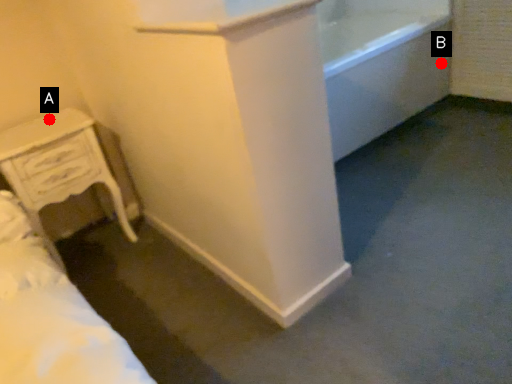
Question: Two points are circled on the image, labeled by A and B beside each circle. Which point is farther to the camera?

Choices:
 (A) A is further
 (B) B is further

Answer: (B)